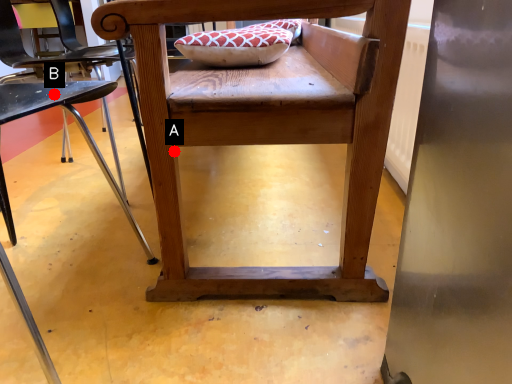
Question: Two points are circled on the image, labeled by A and B beside each circle. Among these points, which one is farthest from the camera?

Choices:
 (A) A is further
 (B) B is further

Answer: (A)